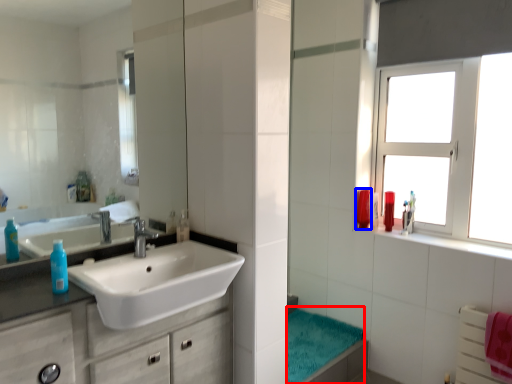
Question: Which point is closer to the camera, bath towel (highlighted by a red box) or mouthwash (highlighted by a blue box)?

Choices:
 (A) bath towel
 (B) mouthwash

Answer: (A)